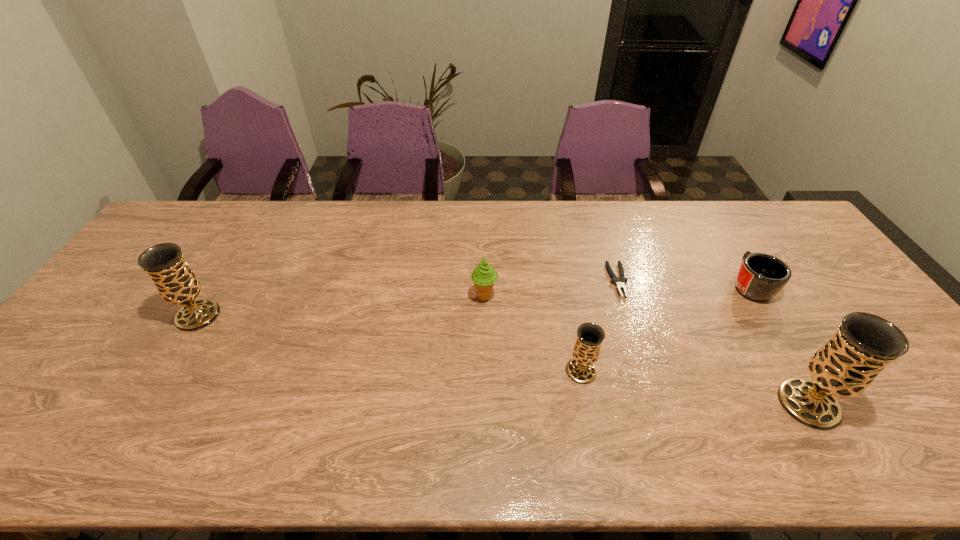
Locate an element on the screen. Image resolution: width=960 pixels, height=540 pixels. vacant space located 0.270m on the back of the shortest chalice is located at coordinates tap(564, 284).

The width and height of the screenshot is (960, 540). In order to click on free region located on the left of the rightmost chalice in this screenshot , I will do `click(631, 404)`.

This screenshot has width=960, height=540. Identify the location of vacant region located 0.220m on the back of the second object from left to right. (484, 241).

Where is `vacant space located 0.210m at the gripping part of the pliers`? vacant space located 0.210m at the gripping part of the pliers is located at coordinates (643, 360).

The image size is (960, 540). What are the coordinates of `free location located 0.300m on the side of the second shortest object with the handle` in the screenshot? It's located at (703, 211).

You are a GUI agent. You are given a task and a screenshot of the screen. Output one action in this format:
    pyautogui.click(x=<x>, y=<y>)
    Task: Click on the free location located on the side of the second shortest object with the handle
    The width and height of the screenshot is (960, 540).
    Given the screenshot: What is the action you would take?
    pyautogui.click(x=702, y=209)

This screenshot has width=960, height=540. Find the location of `vacant space located on the side of the second shortest object with the handle`. vacant space located on the side of the second shortest object with the handle is located at coordinates (732, 256).

Locate an element on the screen. object located in the near edge section of the desktop is located at coordinates (864, 344).

Image resolution: width=960 pixels, height=540 pixels. In the image, there is a desktop. Find the location of `free region at the far edge`. free region at the far edge is located at coordinates (205, 239).

What are the coordinates of `vacant space at the near edge of the desktop` in the screenshot? It's located at [x=573, y=399].